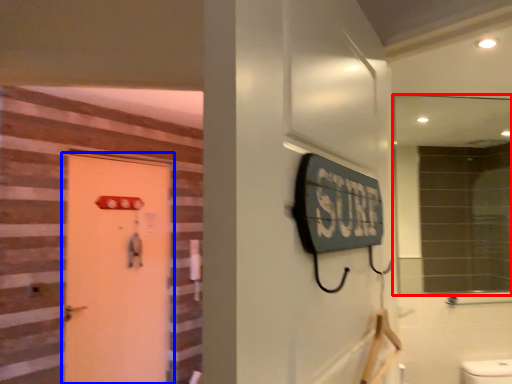
Question: Among these objects, which one is nearest to the camera, mirror (highlighted by a red box) or door (highlighted by a blue box)?

Choices:
 (A) mirror
 (B) door

Answer: (A)